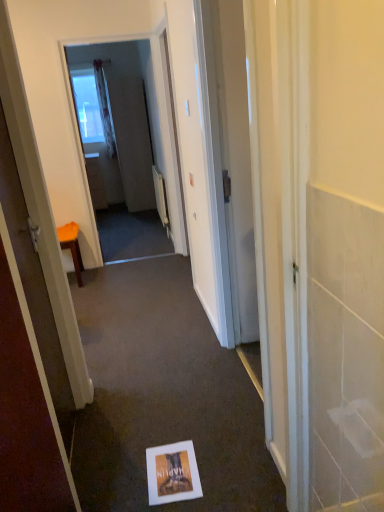
Question: Is orange fabric stool at left touching matte white screen door at upper center, the second screen door from the back?

Choices:
 (A) yes
 (B) no

Answer: (B)

Question: Can you confirm if orange fabric stool at left is thinner than matte white screen door at upper center, the 1th screen door from the front?

Choices:
 (A) no
 (B) yes

Answer: (A)

Question: From the image's perspective, would you say orange fabric stool at left is shown under matte white screen door at upper center, the second screen door from the back?

Choices:
 (A) yes
 (B) no

Answer: (A)

Question: Does orange fabric stool at left have a greater height compared to matte white screen door at upper center, the second screen door from the back?

Choices:
 (A) yes
 (B) no

Answer: (B)

Question: Is orange fabric stool at left closer to the viewer compared to matte white screen door at upper center, the 1th screen door from the front?

Choices:
 (A) no
 (B) yes

Answer: (A)

Question: Is point click(x=147, y=102) positioned closer to the camera than point click(x=79, y=279)?

Choices:
 (A) closer
 (B) farther

Answer: (B)

Question: Looking at their shapes, would you say matte white screen door at upper center, the 1th screen door from the front, is wider or thinner than orange fabric stool at left?

Choices:
 (A) wide
 (B) thin

Answer: (B)

Question: Based on their positions, is matte white screen door at upper center, the second screen door from the back, located to the left or right of orange fabric stool at left?

Choices:
 (A) left
 (B) right

Answer: (B)

Question: From the image's perspective, is matte white screen door at upper center, the 1th screen door from the front, located above or below orange fabric stool at left?

Choices:
 (A) below
 (B) above

Answer: (B)

Question: In terms of height, does matte gray screen door at center, acting as the second screen door starting from the front, look taller or shorter compared to matte white screen door at upper center, the 1th screen door from the front?

Choices:
 (A) tall
 (B) short

Answer: (B)

Question: Does point (150, 187) appear closer or farther from the camera than point (89, 53)?

Choices:
 (A) closer
 (B) farther

Answer: (A)

Question: From a real-world perspective, is matte gray screen door at center, acting as the second screen door starting from the front, physically located above or below matte white screen door at upper center, the second screen door from the back?

Choices:
 (A) below
 (B) above

Answer: (A)

Question: Is matte gray screen door at center, which is the first screen door in back-to-front order, bigger or smaller than matte white screen door at upper center, the second screen door from the back?

Choices:
 (A) big
 (B) small

Answer: (A)

Question: Considering the positions of point (79, 254) and point (152, 204), is point (79, 254) closer or farther from the camera than point (152, 204)?

Choices:
 (A) farther
 (B) closer

Answer: (B)

Question: Would you say orange fabric stool at left is inside or outside matte gray screen door at center, acting as the second screen door starting from the front?

Choices:
 (A) inside
 (B) outside

Answer: (B)